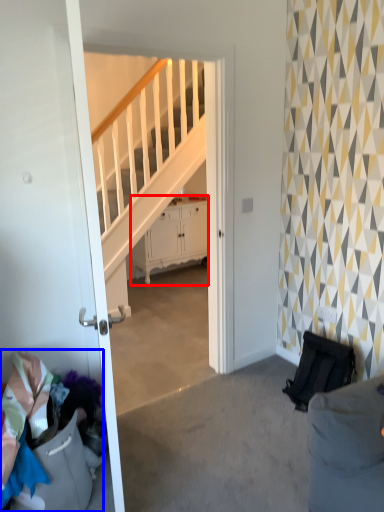
Question: Which object is further to the camera taking this photo, cabinetry (highlighted by a red box) or laundry (highlighted by a blue box)?

Choices:
 (A) cabinetry
 (B) laundry

Answer: (A)